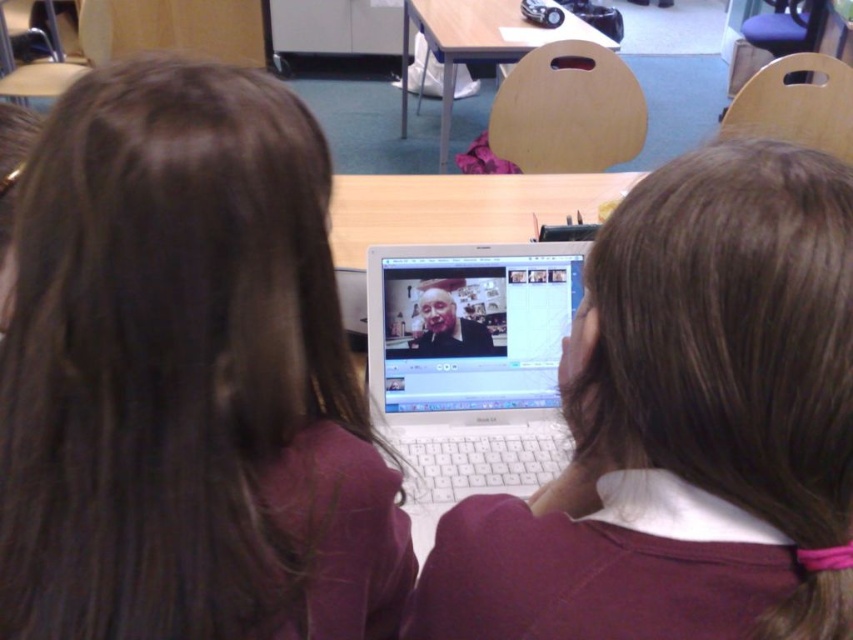
Question: Which object appears closest to the camera in this image?

Choices:
 (A) wooden table at center
 (B) smooth skin face at center

Answer: (B)

Question: Can you confirm if maroon sweater at center is positioned above silver metallic laptop at center?

Choices:
 (A) yes
 (B) no

Answer: (B)

Question: Is white plastic laptop at center thinner than smooth skin face at center?

Choices:
 (A) yes
 (B) no

Answer: (B)

Question: Which of the following is the farthest from the observer?

Choices:
 (A) wooden table at center
 (B) silver metallic laptop at center

Answer: (A)

Question: Does wooden table at center have a smaller size compared to smooth skin face at center?

Choices:
 (A) no
 (B) yes

Answer: (A)

Question: Which object is positioned closest to the white plastic laptop at center?

Choices:
 (A) maroon sweater at center
 (B) silver metallic laptop at center
 (C) matte purple sweater at center

Answer: (B)